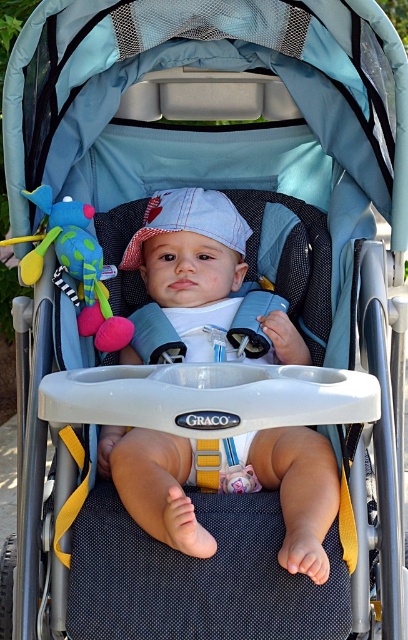
Question: Which point is farther from the camera taking this photo?

Choices:
 (A) (204, 472)
 (B) (81, 330)

Answer: (B)

Question: Which of the following is the farthest from the observer?

Choices:
 (A) green plush toy at center
 (B) white cotton hat at center

Answer: (B)

Question: Does white cotton hat at center have a larger size compared to green plush toy at center?

Choices:
 (A) no
 (B) yes

Answer: (B)

Question: Does white cotton hat at center have a greater width compared to green plush toy at center?

Choices:
 (A) yes
 (B) no

Answer: (A)

Question: Where is white cotton hat at center located in relation to green plush toy at center in the image?

Choices:
 (A) right
 (B) left

Answer: (A)

Question: Which object is farther from the camera taking this photo?

Choices:
 (A) white cotton hat at center
 (B) green plush toy at center

Answer: (A)